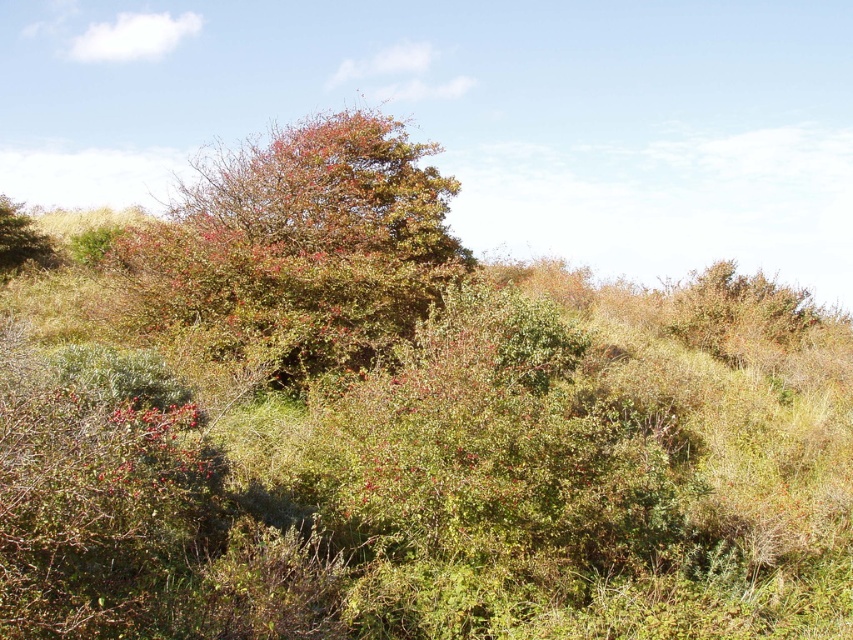
Question: Can you confirm if green leafy bush at center is positioned above green leafy bush at left?

Choices:
 (A) no
 (B) yes

Answer: (B)

Question: Does green leafy bush at center have a smaller size compared to green leafy bush at left?

Choices:
 (A) yes
 (B) no

Answer: (B)

Question: Considering the relative positions of green leafy bush at center and green leafy bush at left in the image provided, where is green leafy bush at center located with respect to green leafy bush at left?

Choices:
 (A) left
 (B) right

Answer: (B)

Question: Which point appears closest to the camera in this image?

Choices:
 (A) (234, 157)
 (B) (36, 264)

Answer: (A)

Question: Which point is farther to the camera?

Choices:
 (A) green leafy bush at center
 (B) green leafy bush at left

Answer: (B)